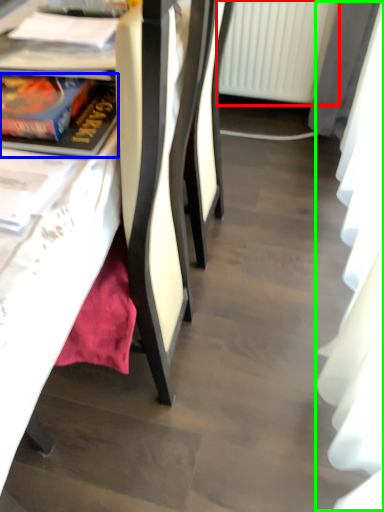
Question: Which is farther away from radiator (highlighted by a red box)? book (highlighted by a blue box) or curtain (highlighted by a green box)?

Choices:
 (A) book
 (B) curtain

Answer: (A)